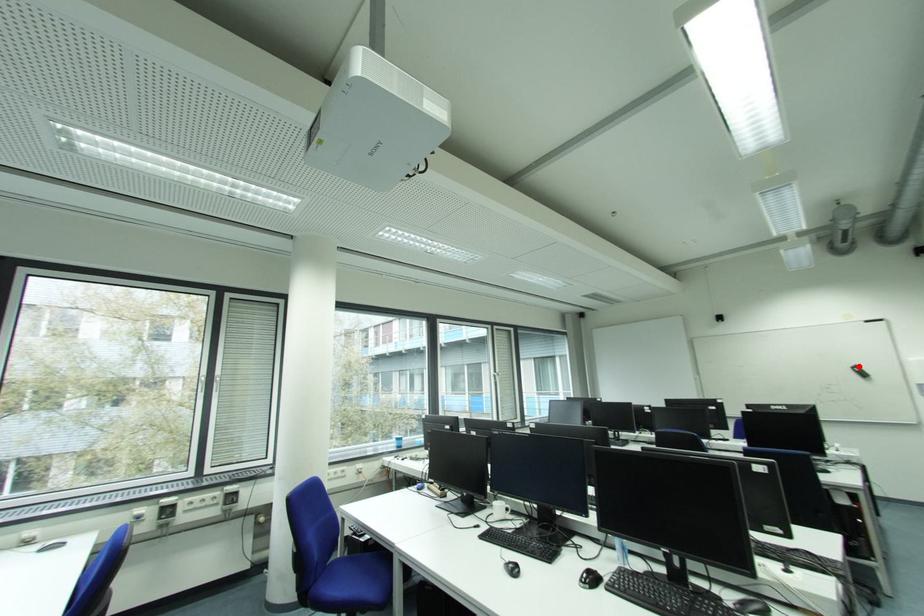
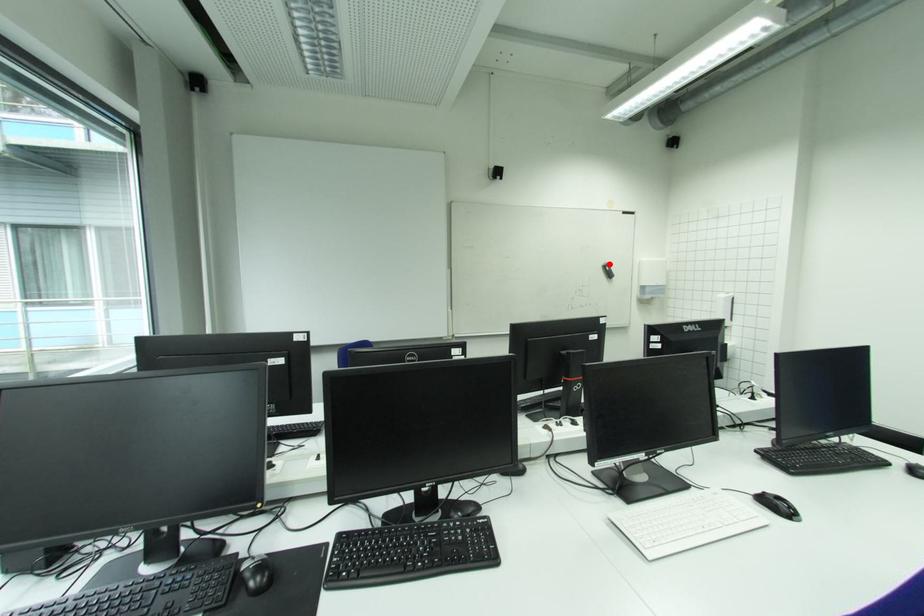
I am providing you with two images of the same scene from different viewpoints. A red point is marked on the first image and another point is marked on the second image. Do the highlighted points in image1 and image2 indicate the same real-world spot?

Yes